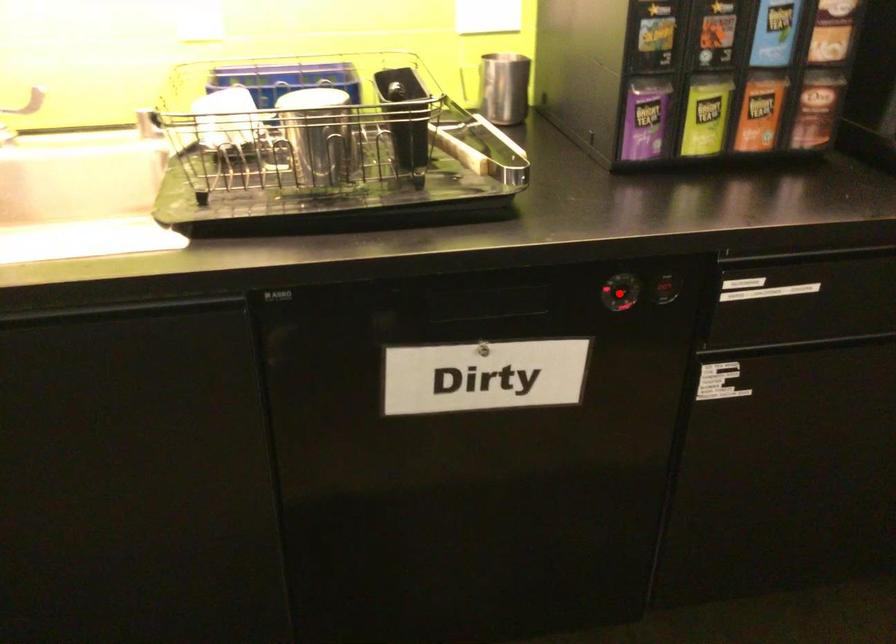
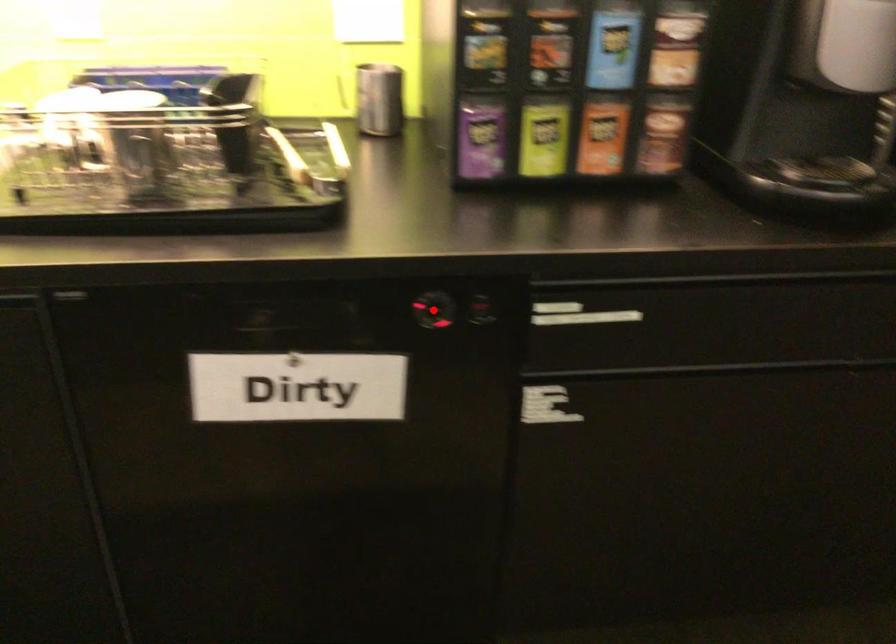
I am providing you with two images of the same scene from different viewpoints. A red point is marked on the first image and another point is marked on the second image. Is the marked point in image1 the same physical position as the marked point in image2?

Yes